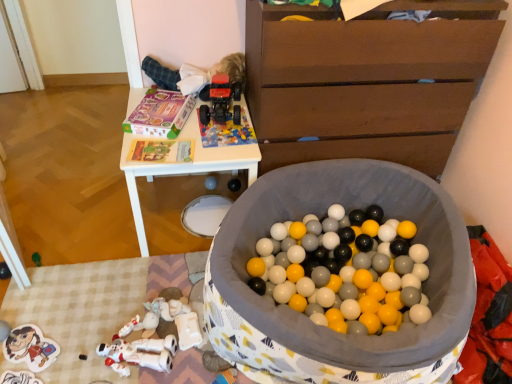
Find the location of a particular element. This screenshot has width=512, height=384. vacant area located to the right-hand side of matte plastic sticker at lower left, which is counted as the 1th toy, starting from the left is located at coordinates click(81, 347).